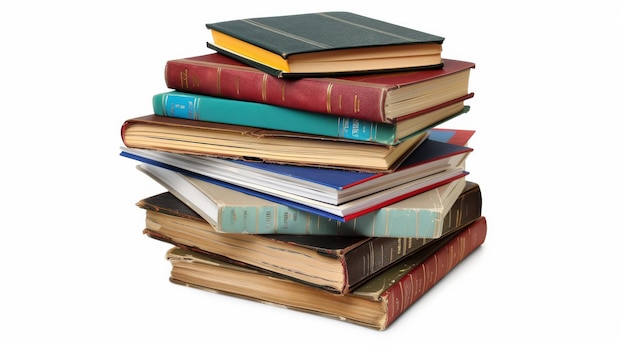
Image resolution: width=626 pixels, height=351 pixels. What are the coordinates of `book` in the screenshot? It's located at (347, 41), (385, 92), (349, 132), (329, 156), (349, 195), (270, 224), (339, 257), (401, 304), (463, 133).